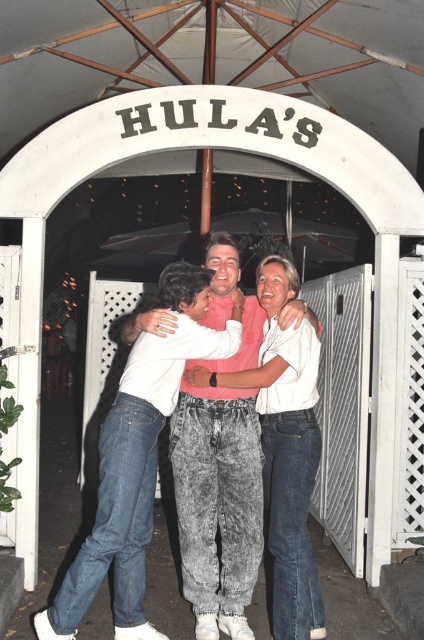
Question: Which object is closer to the camera taking this photo?

Choices:
 (A) denim pants at center
 (B) white cotton shirt at center

Answer: (A)

Question: Among these points, which one is farthest from the camera?

Choices:
 (A) (134, 445)
 (B) (219, 413)

Answer: (B)

Question: Can you confirm if white cotton shirt at center is positioned to the left of denim pants at center?

Choices:
 (A) yes
 (B) no

Answer: (B)

Question: Is white cotton shirt at center below denim pants at center?

Choices:
 (A) yes
 (B) no

Answer: (B)

Question: Can you confirm if white cotton shirt at center is wider than denim pants at center?

Choices:
 (A) no
 (B) yes

Answer: (A)